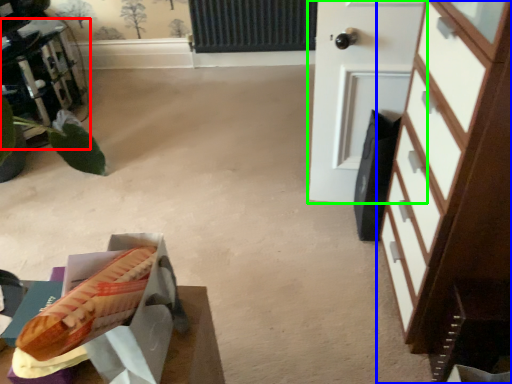
Question: Which object is positioned farthest from furniture (highlighted by a red box)? Select from chest of drawers (highlighted by a blue box) and door (highlighted by a green box).

Choices:
 (A) chest of drawers
 (B) door

Answer: (A)